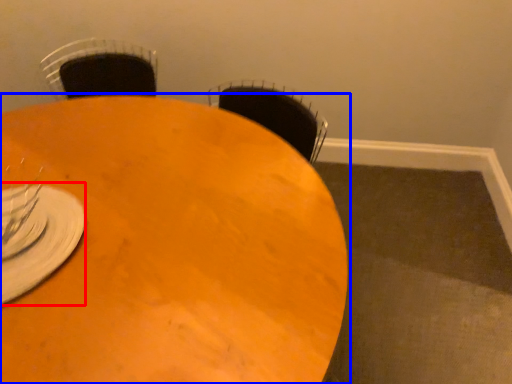
Question: Which object appears closest to the camera in this image, tableware (highlighted by a red box) or table (highlighted by a blue box)?

Choices:
 (A) tableware
 (B) table

Answer: (B)